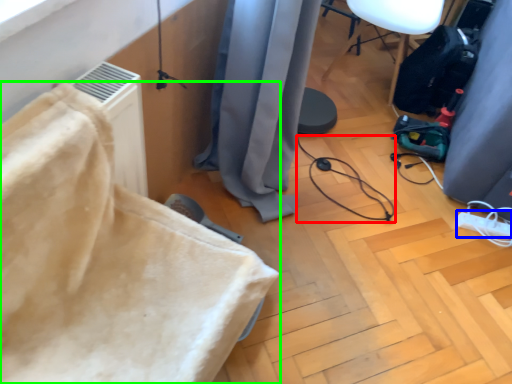
Question: Which object is positioned closest to cable (highlighted by a red box)? Select from extension cord (highlighted by a blue box) and furniture (highlighted by a green box).

Choices:
 (A) extension cord
 (B) furniture

Answer: (A)